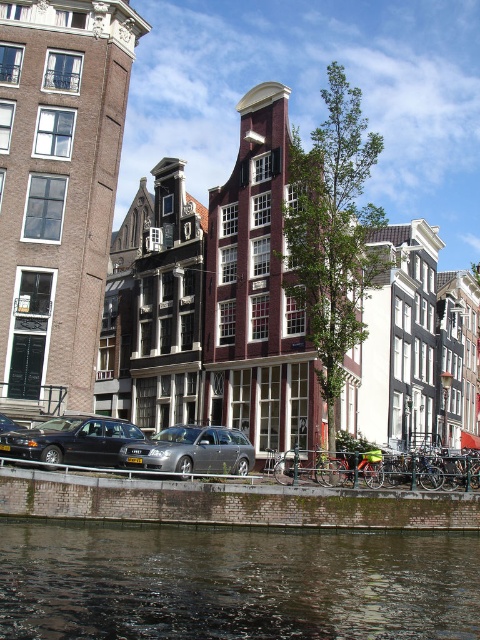
Does dark green water at lower center have a lesser width compared to shiny black sedan at lower left?

Incorrect, dark green water at lower center's width is not less than shiny black sedan at lower left's.

Does dark green water at lower center appear over shiny black sedan at lower left?

No, dark green water at lower center is not above shiny black sedan at lower left.

Between point (365, 628) and point (57, 460), which one is positioned behind?

Point (57, 460)

Where is `dark green water at lower center`? dark green water at lower center is located at coordinates (233, 582).

Does point (405, 541) come closer to viewer compared to point (228, 432)?

Yes, point (405, 541) is in front of point (228, 432).

Does dark green water at lower center have a greater width compared to metallic gray wagon at center?

Indeed, dark green water at lower center has a greater width compared to metallic gray wagon at center.

The width and height of the screenshot is (480, 640). Find the location of `dark green water at lower center`. dark green water at lower center is located at coordinates (233, 582).

Who is more distant from viewer, (x=99, y=429) or (x=212, y=458)?

Positioned behind is point (x=99, y=429).

Where is `shiny black sedan at lower left`? shiny black sedan at lower left is located at coordinates (72, 440).